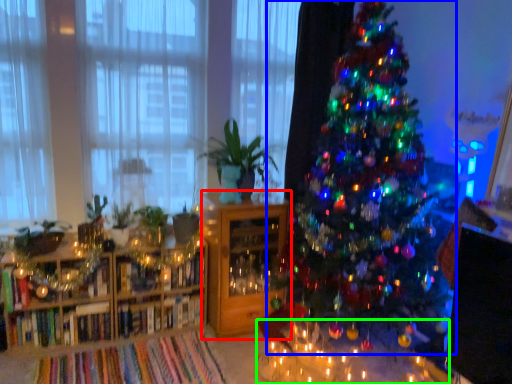
Question: Which object is the closest to the shelf (highlighted by a red box)? Choose among these: christmas tree (highlighted by a blue box) or table (highlighted by a green box).

Choices:
 (A) christmas tree
 (B) table

Answer: (B)